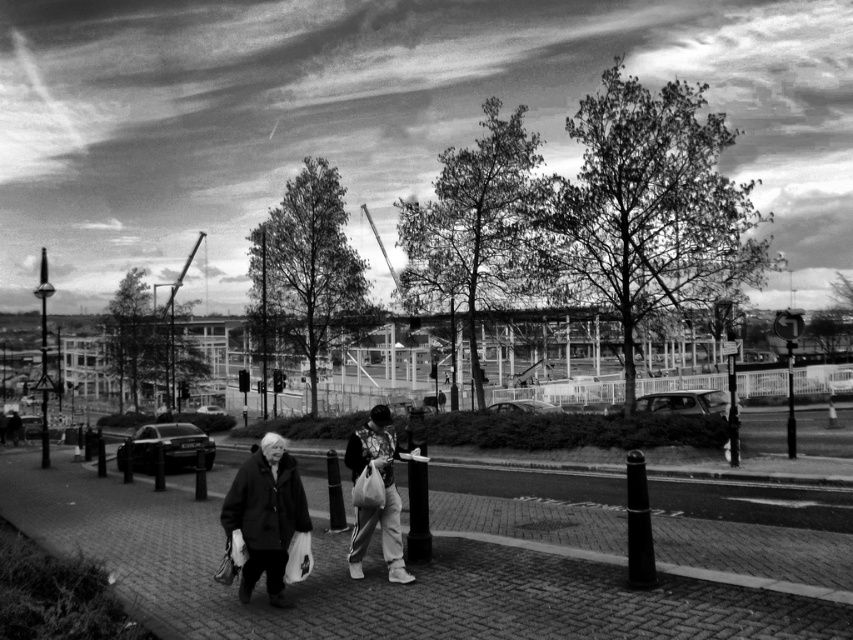
Who is positioned more to the left, dark wool coat at center or shiny metallic car at center-right?

dark wool coat at center is more to the left.

Image resolution: width=853 pixels, height=640 pixels. Identify the location of dark wool coat at center. (265, 516).

Identify the location of dark wool coat at center. (265, 516).

Is shiny black sedan at center-left smaller than shiny metallic car at center?

Incorrect, shiny black sedan at center-left is not smaller in size than shiny metallic car at center.

Based on the photo, which is above, shiny black sedan at center-left or shiny metallic car at center?

shiny metallic car at center is higher up.

Where is `shiny black sedan at center-left`? The width and height of the screenshot is (853, 640). shiny black sedan at center-left is located at coordinates (166, 448).

Is brick pavement at lower left below patterned fabric jacket at center?

Indeed, brick pavement at lower left is positioned under patterned fabric jacket at center.

Who is more distant from viewer, (526, 636) or (399, 540)?

The point (399, 540) is more distant.

What are the coordinates of `brick pavement at lower left` in the screenshot? It's located at point(444,568).